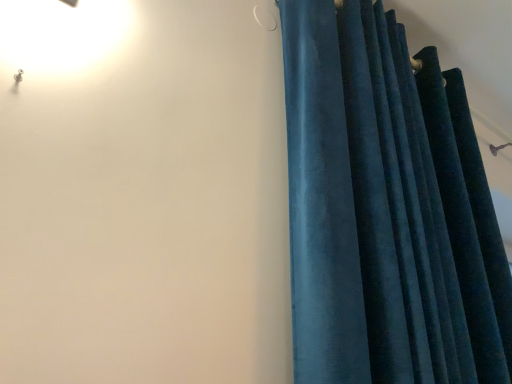
This screenshot has width=512, height=384. What do you see at coordinates (387, 209) in the screenshot?
I see `velvet blue curtain at right` at bounding box center [387, 209].

Measure the distance between velvet blue curtain at right and camera.

They are 27.53 inches apart.

At what (x,y) coordinates should I click in order to perform the action: click on velvet blue curtain at right. Please return your answer as a coordinate pair (x, y). The image size is (512, 384). Looking at the image, I should click on (387, 209).

Locate an element on the screen. This screenshot has width=512, height=384. velvet blue curtain at right is located at coordinates (387, 209).